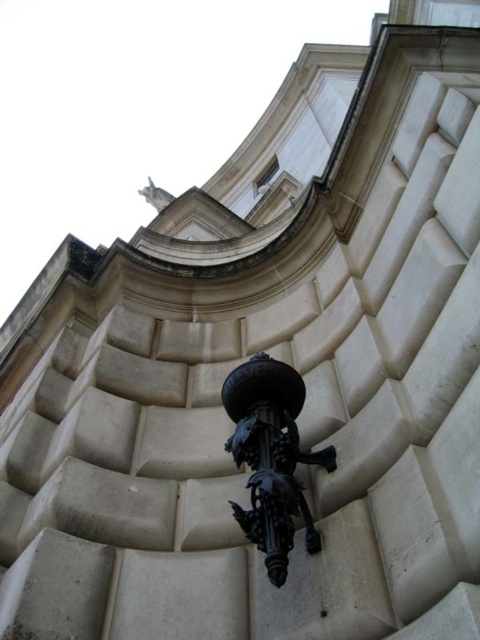
Who is more distant from viewer, (x=284, y=472) or (x=155, y=196)?

The point (x=155, y=196) is behind.

Is point (275, 536) farther from camera compared to point (144, 196)?

No, (275, 536) is in front of (144, 196).

The width and height of the screenshot is (480, 640). Describe the element at coordinates (271, 458) in the screenshot. I see `black wrought iron at center` at that location.

This screenshot has width=480, height=640. I want to click on black wrought iron at center, so click(x=271, y=458).